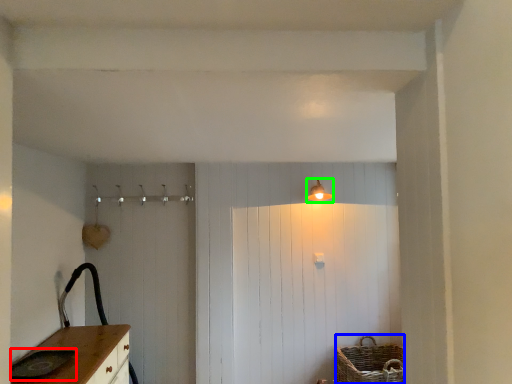
Question: Which object is the closest to the sink (highlighted by a red box)? Choose among these: basket (highlighted by a blue box) or light fixture (highlighted by a green box).

Choices:
 (A) basket
 (B) light fixture

Answer: (A)